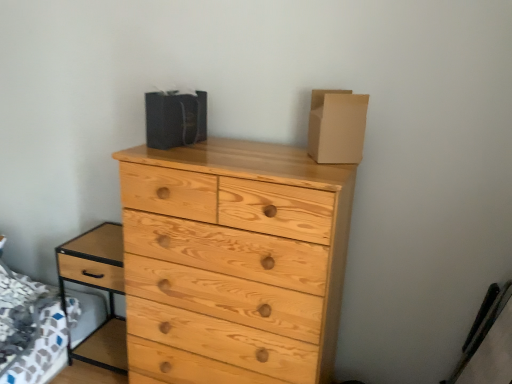
Find the location of a particular element. Image resolution: width=512 pixels, height=384 pixels. free point above natural wood chest of drawers at center (from a real-world perspective) is located at coordinates (237, 150).